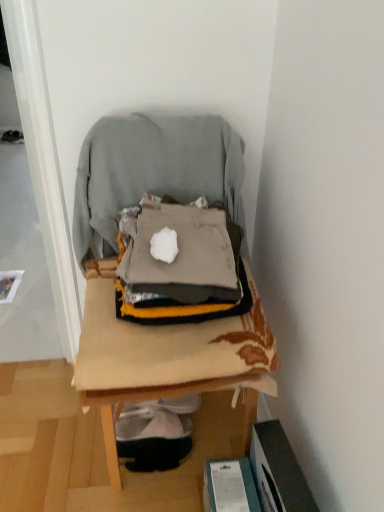
This screenshot has width=384, height=512. Describe the element at coordinates (165, 266) in the screenshot. I see `wooden chair at center` at that location.

Locate an element on the screen. Image resolution: width=384 pixels, height=512 pixels. wooden chair at center is located at coordinates (165, 266).

This screenshot has height=512, width=384. What do you see at coordinates (153, 170) in the screenshot?
I see `gray fabric bean bag chair at center` at bounding box center [153, 170].

Find the location of a particular element. gray fabric bean bag chair at center is located at coordinates (153, 170).

What is the approximate width of gray fabric bean bag chair at center?

gray fabric bean bag chair at center is 6.29 inches in width.

The height and width of the screenshot is (512, 384). What are the coordinates of `wooden chair at center` in the screenshot? It's located at (165, 266).

Considering the relative positions of wooden chair at center and gray fabric bean bag chair at center in the image provided, is wooden chair at center to the left of gray fabric bean bag chair at center from the viewer's perspective?

No.

From the picture: Between wooden chair at center and gray fabric bean bag chair at center, which one is positioned in front?

wooden chair at center is more forward.

Considering the points (217, 143) and (168, 192), which point is in front, point (217, 143) or point (168, 192)?

The point (217, 143) is more forward.

From the image's perspective, which one is positioned higher, wooden chair at center or gray fabric bean bag chair at center?

From the image's view, gray fabric bean bag chair at center is above.

From a real-world perspective, which object rests below the other?

wooden chair at center, from a real-world perspective.

Between wooden chair at center and gray fabric bean bag chair at center, which one has smaller width?

Thinner between the two is gray fabric bean bag chair at center.

Does wooden chair at center have a greater height compared to gray fabric bean bag chair at center?

Yes, wooden chair at center is taller than gray fabric bean bag chair at center.

Considering the relative sizes of wooden chair at center and gray fabric bean bag chair at center in the image provided, is wooden chair at center bigger than gray fabric bean bag chair at center?

Yes.

Would you say wooden chair at center contains gray fabric bean bag chair at center?

Indeed, gray fabric bean bag chair at center is located within wooden chair at center.

Are wooden chair at center and gray fabric bean bag chair at center located far from each other?

No, wooden chair at center is not far away from gray fabric bean bag chair at center.

Consider the image. Does wooden chair at center turn towards gray fabric bean bag chair at center?

Yes.

What's the angular difference between wooden chair at center and gray fabric bean bag chair at center's facing directions?

0.00379 degrees separate the facing orientations of wooden chair at center and gray fabric bean bag chair at center.

Measure the distance between wooden chair at center and gray fabric bean bag chair at center.

wooden chair at center and gray fabric bean bag chair at center are 4.87 inches apart.

Where is `bean bag chair behind the wooden chair at center`? bean bag chair behind the wooden chair at center is located at coordinates (153, 170).

Would you say gray fabric bean bag chair at center is to the left or to the right of wooden chair at center in the picture?

gray fabric bean bag chair at center is positioned on wooden chair at center's left side.

Considering the relative positions of gray fabric bean bag chair at center and wooden chair at center in the image provided, is gray fabric bean bag chair at center in front of wooden chair at center?

No, gray fabric bean bag chair at center is behind wooden chair at center.

Is point (140, 149) positioned in front of point (123, 352)?

That is False.

From the image's perspective, is gray fabric bean bag chair at center above or below wooden chair at center?

Based on their image positions, gray fabric bean bag chair at center is located above wooden chair at center.

Looking at this image, from a real-world perspective, is gray fabric bean bag chair at center beneath wooden chair at center?

Actually, gray fabric bean bag chair at center is physically above wooden chair at center in the real world.

Which of these two, gray fabric bean bag chair at center or wooden chair at center, is thinner?

Thinner between the two is gray fabric bean bag chair at center.

Between gray fabric bean bag chair at center and wooden chair at center, which one has more height?

Standing taller between the two is wooden chair at center.

Is gray fabric bean bag chair at center smaller than wooden chair at center?

Correct, gray fabric bean bag chair at center occupies less space than wooden chair at center.

Is gray fabric bean bag chair at center inside the boundaries of wooden chair at center, or outside?

gray fabric bean bag chair at center is contained in wooden chair at center.

Is gray fabric bean bag chair at center directly adjacent to wooden chair at center?

No.

Is gray fabric bean bag chair at center facing towards wooden chair at center?

Yes, gray fabric bean bag chair at center faces towards wooden chair at center.

What are the coordinates of `furniture to the right of gray fabric bean bag chair at center` in the screenshot? It's located at (165, 266).

You are a GUI agent. You are given a task and a screenshot of the screen. Output one action in this format:
    pyautogui.click(x=<x>, y=<y>)
    Task: Click on the furniture located underneath the gray fabric bean bag chair at center (from a real-world perspective)
    
    Given the screenshot: What is the action you would take?
    pyautogui.click(x=165, y=266)

What are the coordinates of `bean bag chair lying above the wooden chair at center (from the image's perspective)` in the screenshot? It's located at (153, 170).